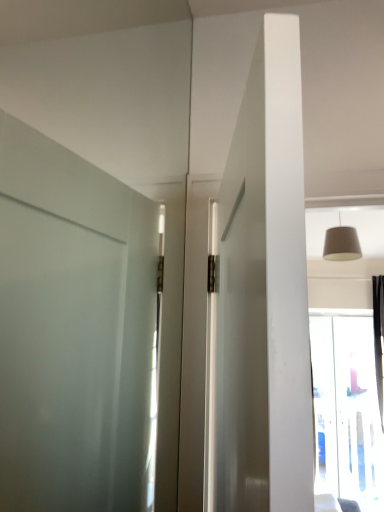
What do you see at coordinates (347, 409) in the screenshot? This screenshot has height=512, width=384. I see `transparent glass window at upper right` at bounding box center [347, 409].

I want to click on transparent glass window at upper right, so click(347, 409).

In order to face matte beige lampshade at upper right, should I rotate leftwards or rightwards?

Turn right by 18.991 degrees to look at matte beige lampshade at upper right.

Measure the distance between matte beige lampshade at upper right and camera.

matte beige lampshade at upper right and camera are 8.97 feet apart.

Measure the distance between point (331, 245) and camera.

The distance of point (331, 245) from camera is 2.86 meters.

Locate an element on the screen. The width and height of the screenshot is (384, 512). matte beige lampshade at upper right is located at coordinates (341, 243).

The width and height of the screenshot is (384, 512). Describe the element at coordinates (341, 243) in the screenshot. I see `matte beige lampshade at upper right` at that location.

Where is `transparent glass window at upper right`? This screenshot has width=384, height=512. transparent glass window at upper right is located at coordinates (347, 409).

In the image, is transparent glass window at upper right on the left side or the right side of matte beige lampshade at upper right?

In the image, transparent glass window at upper right appears on the right side of matte beige lampshade at upper right.

Which object is more forward, transparent glass window at upper right or matte beige lampshade at upper right?

matte beige lampshade at upper right.

Considering the points (319, 420) and (355, 259), which point is in front, point (319, 420) or point (355, 259)?

Point (355, 259)

From the image's perspective, between transparent glass window at upper right and matte beige lampshade at upper right, who is located below?

transparent glass window at upper right appears lower in the image.

From a real-world perspective, is transparent glass window at upper right positioned under matte beige lampshade at upper right based on gravity?

Yes, from a real-world perspective, transparent glass window at upper right is under matte beige lampshade at upper right.

Which object is wider, transparent glass window at upper right or matte beige lampshade at upper right?

matte beige lampshade at upper right.

Is transparent glass window at upper right taller or shorter than matte beige lampshade at upper right?

In the image, transparent glass window at upper right appears to be taller than matte beige lampshade at upper right.

Who is bigger, transparent glass window at upper right or matte beige lampshade at upper right?

With larger size is transparent glass window at upper right.

Is transparent glass window at upper right inside or outside of matte beige lampshade at upper right?

transparent glass window at upper right is located beyond the bounds of matte beige lampshade at upper right.

Based on the photo, is transparent glass window at upper right next to matte beige lampshade at upper right?

No.

Is transparent glass window at upper right positioned with its back to matte beige lampshade at upper right?

No, transparent glass window at upper right's orientation is not away from matte beige lampshade at upper right.

How different are the orientations of transparent glass window at upper right and matte beige lampshade at upper right in degrees?

0.19 degrees separate the facing orientations of transparent glass window at upper right and matte beige lampshade at upper right.

Identify the location of window located behind the matte beige lampshade at upper right. The height and width of the screenshot is (512, 384). (347, 409).

Is matte beige lampshade at upper right at the left side of transparent glass window at upper right?

Yes.

Considering the relative positions of matte beige lampshade at upper right and transparent glass window at upper right in the image provided, is matte beige lampshade at upper right behind transparent glass window at upper right?

No, matte beige lampshade at upper right is closer to the viewer.

Which is behind, point (359, 245) or point (354, 456)?

The point (354, 456) is farther from the camera.

From the image's perspective, is matte beige lampshade at upper right positioned above or below transparent glass window at upper right?

Clearly, from the image's perspective, matte beige lampshade at upper right is above transparent glass window at upper right.

From a real-world perspective, is matte beige lampshade at upper right located higher than transparent glass window at upper right?

Yes, from a real-world perspective, matte beige lampshade at upper right is over transparent glass window at upper right

Which object is wider, matte beige lampshade at upper right or transparent glass window at upper right?

matte beige lampshade at upper right is wider.

Considering the relative sizes of matte beige lampshade at upper right and transparent glass window at upper right in the image provided, is matte beige lampshade at upper right shorter than transparent glass window at upper right?

Yes, matte beige lampshade at upper right is shorter than transparent glass window at upper right.

Who is bigger, matte beige lampshade at upper right or transparent glass window at upper right?

transparent glass window at upper right is bigger.

Is transparent glass window at upper right inside matte beige lampshade at upper right?

No, transparent glass window at upper right is not a part of matte beige lampshade at upper right.

Is the surface of matte beige lampshade at upper right in direct contact with transparent glass window at upper right?

matte beige lampshade at upper right is not next to transparent glass window at upper right, and they're not touching.

Is matte beige lampshade at upper right oriented away from transparent glass window at upper right?

No, matte beige lampshade at upper right's orientation is not away from transparent glass window at upper right.

How different are the orientations of matte beige lampshade at upper right and transparent glass window at upper right in degrees?

The facing directions of matte beige lampshade at upper right and transparent glass window at upper right are 0.19 degrees apart.

Could you measure the distance between matte beige lampshade at upper right and transparent glass window at upper right?

A distance of 2.07 meters exists between matte beige lampshade at upper right and transparent glass window at upper right.

Where is `window below the matte beige lampshade at upper right (from the image's perspective)`? This screenshot has height=512, width=384. window below the matte beige lampshade at upper right (from the image's perspective) is located at coordinates (347, 409).

The image size is (384, 512). I want to click on window that appears below the matte beige lampshade at upper right (from a real-world perspective), so click(347, 409).

You are a GUI agent. You are given a task and a screenshot of the screen. Output one action in this format:
    pyautogui.click(x=<x>, y=<y>)
    Task: Click on the window behind the matte beige lampshade at upper right
    The width and height of the screenshot is (384, 512).
    Given the screenshot: What is the action you would take?
    pyautogui.click(x=347, y=409)